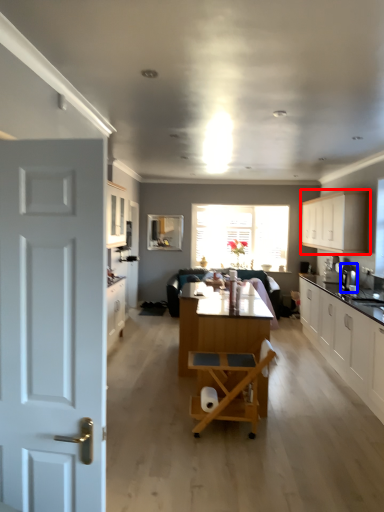
Question: Among these objects, which one is nearest to the camera, cabinetry (highlighted by a red box) or coffee machine (highlighted by a blue box)?

Choices:
 (A) cabinetry
 (B) coffee machine

Answer: (B)